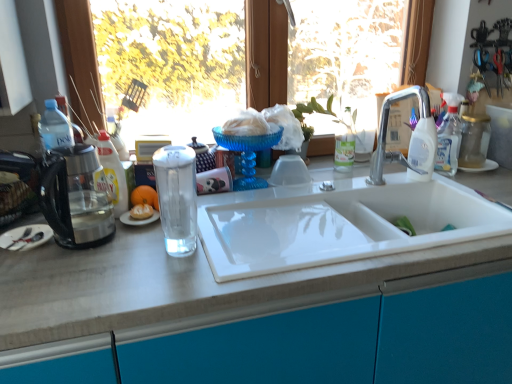
Find the location of `free location in front of clear glass bottle at left`. free location in front of clear glass bottle at left is located at coordinates (106, 246).